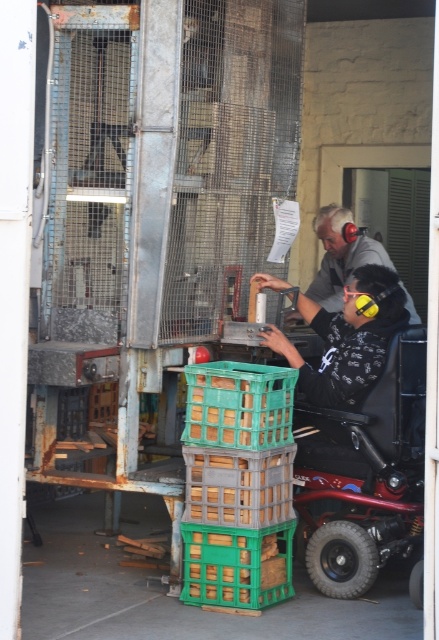
You are standing at the point labeled as point [359,236]. You want to move towards the point labeled as point [359,528]. Which direction should you move?

You should move forward because point [359,528] is in front of point [359,236].

From the picture: You are standing in the workshop and need to move the gray fabric shirt at upper right to the left side of the room. Can you do this without moving the red metallic wheelchair at lower right?

The red metallic wheelchair at lower right is to the right of gray fabric shirt at upper right. Since the wheelchair is already positioned to the right of the shirt, moving the shirt further to the left side of the room would not require moving the wheelchair. Therefore, yes, you can move the gray fabric shirt at upper right to the left side without moving the red metallic wheelchair at lower right.

You are organizing a workshop in this area and need to ensure there is enough space for the red metallic wheelchair at lower right and the gray fabric shirt at upper right. Which object requires more horizontal space to accommodate?

The red metallic wheelchair at lower right requires more horizontal space because its width is larger than that of the gray fabric shirt at upper right.